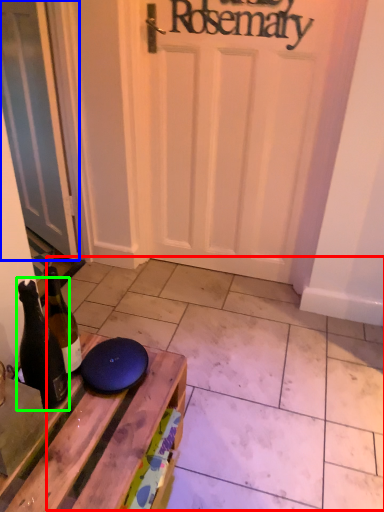
Question: Estimate the real-world distances between objects in this image. Which object is farther from tile (highlighted by a red box), door (highlighted by a blue box) or bottle (highlighted by a green box)?

Choices:
 (A) door
 (B) bottle

Answer: (A)